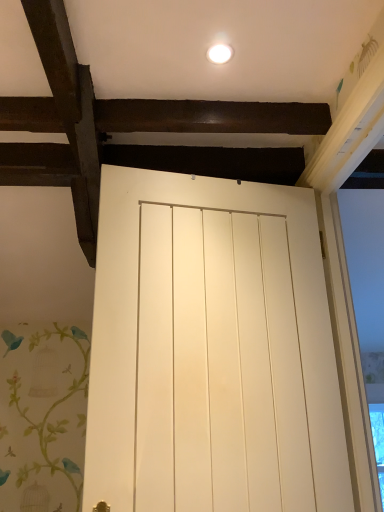
Question: Does white glossy light fixture at upper center come in front of white matte door at center?

Choices:
 (A) no
 (B) yes

Answer: (A)

Question: From the image's perspective, is white glossy light fixture at upper center beneath white matte door at center?

Choices:
 (A) yes
 (B) no

Answer: (B)

Question: From a real-world perspective, is white glossy light fixture at upper center physically below white matte door at center?

Choices:
 (A) yes
 (B) no

Answer: (B)

Question: Considering the relative positions of white glossy light fixture at upper center and white matte door at center in the image provided, is white glossy light fixture at upper center to the right of white matte door at center from the viewer's perspective?

Choices:
 (A) yes
 (B) no

Answer: (B)

Question: Is white glossy light fixture at upper center surrounding white matte door at center?

Choices:
 (A) yes
 (B) no

Answer: (B)

Question: From the image's perspective, is white glossy light fixture at upper center over white matte door at center?

Choices:
 (A) no
 (B) yes

Answer: (B)

Question: Is white matte door at center positioned behind white glossy light fixture at upper center?

Choices:
 (A) no
 (B) yes

Answer: (A)

Question: Is white matte door at center smaller than white glossy light fixture at upper center?

Choices:
 (A) no
 (B) yes

Answer: (A)

Question: Does white matte door at center appear on the right side of white glossy light fixture at upper center?

Choices:
 (A) no
 (B) yes

Answer: (B)

Question: From a real-world perspective, is white matte door at center below white glossy light fixture at upper center?

Choices:
 (A) no
 (B) yes

Answer: (B)

Question: From a real-world perspective, is white matte door at center over white glossy light fixture at upper center?

Choices:
 (A) yes
 (B) no

Answer: (B)

Question: Is white glossy light fixture at upper center located within white matte door at center?

Choices:
 (A) yes
 (B) no

Answer: (B)

Question: Is white matte door at center bigger or smaller than white glossy light fixture at upper center?

Choices:
 (A) big
 (B) small

Answer: (A)